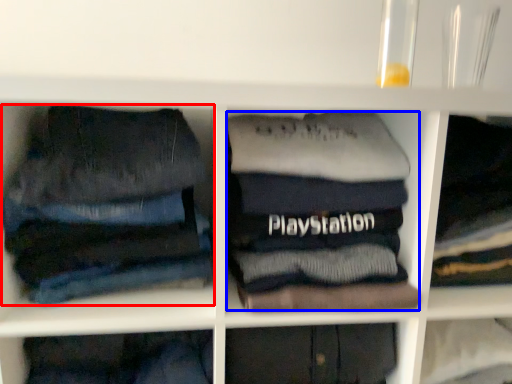
Question: Among these objects, which one is nearest to the camera, trousers (highlighted by a red box) or clothing (highlighted by a blue box)?

Choices:
 (A) trousers
 (B) clothing

Answer: (A)